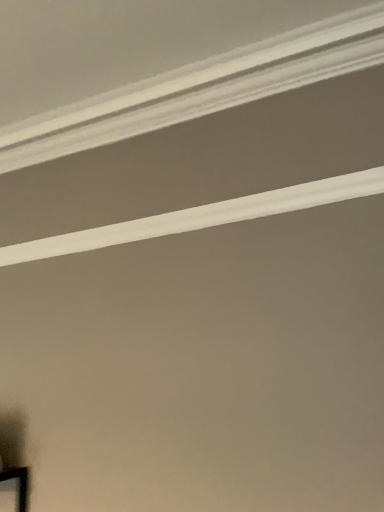
Question: In which direction should I rotate to look at white smooth crown molding at upper center, arranged as the 1th strip when ordered from the bottom?

Choices:
 (A) right
 (B) left

Answer: (B)

Question: Is white smooth crown molding at upper center, the second strip positioned from the bottom, bigger than white smooth crown molding at upper center, arranged as the 1th strip when ordered from the bottom?

Choices:
 (A) yes
 (B) no

Answer: (A)

Question: Can you see white smooth crown molding at upper center, which is counted as the first strip, starting from the top, touching white smooth crown molding at upper center, which is the 2th strip in top-to-bottom order?

Choices:
 (A) no
 (B) yes

Answer: (A)

Question: Is white smooth crown molding at upper center, the second strip positioned from the bottom, shorter than white smooth crown molding at upper center, arranged as the 1th strip when ordered from the bottom?

Choices:
 (A) yes
 (B) no

Answer: (A)

Question: Can you confirm if white smooth crown molding at upper center, the second strip positioned from the bottom, is thinner than white smooth crown molding at upper center, which is the 2th strip in top-to-bottom order?

Choices:
 (A) yes
 (B) no

Answer: (B)

Question: Does white smooth crown molding at upper center, the second strip positioned from the bottom, have a smaller size compared to white smooth crown molding at upper center, arranged as the 1th strip when ordered from the bottom?

Choices:
 (A) no
 (B) yes

Answer: (A)

Question: Does white smooth crown molding at upper center, the second strip positioned from the bottom, lie behind white smooth crown molding at upper center, which is the 2th strip in top-to-bottom order?

Choices:
 (A) yes
 (B) no

Answer: (B)

Question: Does white smooth crown molding at upper center, arranged as the 1th strip when ordered from the bottom, have a smaller size compared to white smooth crown molding at upper center, the second strip positioned from the bottom?

Choices:
 (A) yes
 (B) no

Answer: (A)

Question: From a real-world perspective, is white smooth crown molding at upper center, which is the 2th strip in top-to-bottom order, on top of white smooth crown molding at upper center, the second strip positioned from the bottom?

Choices:
 (A) no
 (B) yes

Answer: (A)

Question: From the image's perspective, is white smooth crown molding at upper center, arranged as the 1th strip when ordered from the bottom, on white smooth crown molding at upper center, which is counted as the first strip, starting from the top?

Choices:
 (A) yes
 (B) no

Answer: (B)

Question: Does white smooth crown molding at upper center, arranged as the 1th strip when ordered from the bottom, have a lesser width compared to white smooth crown molding at upper center, which is counted as the first strip, starting from the top?

Choices:
 (A) no
 (B) yes

Answer: (B)

Question: Is white smooth crown molding at upper center, which is the 2th strip in top-to-bottom order, closer to camera compared to white smooth crown molding at upper center, the second strip positioned from the bottom?

Choices:
 (A) yes
 (B) no

Answer: (B)

Question: Can you confirm if white smooth crown molding at upper center, which is the 2th strip in top-to-bottom order, is positioned to the left of white smooth crown molding at upper center, the second strip positioned from the bottom?

Choices:
 (A) no
 (B) yes

Answer: (A)

Question: From the image's perspective, is white smooth crown molding at upper center, arranged as the 1th strip when ordered from the bottom, positioned above or below white smooth crown molding at upper center, the second strip positioned from the bottom?

Choices:
 (A) below
 (B) above

Answer: (A)